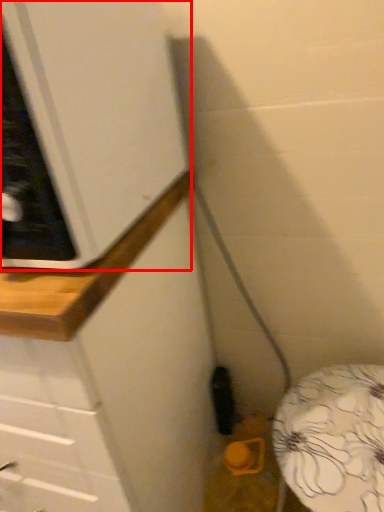
Question: Where is cabinetry (annotated by the red box) located in relation to counter in the image?

Choices:
 (A) right
 (B) left

Answer: (B)